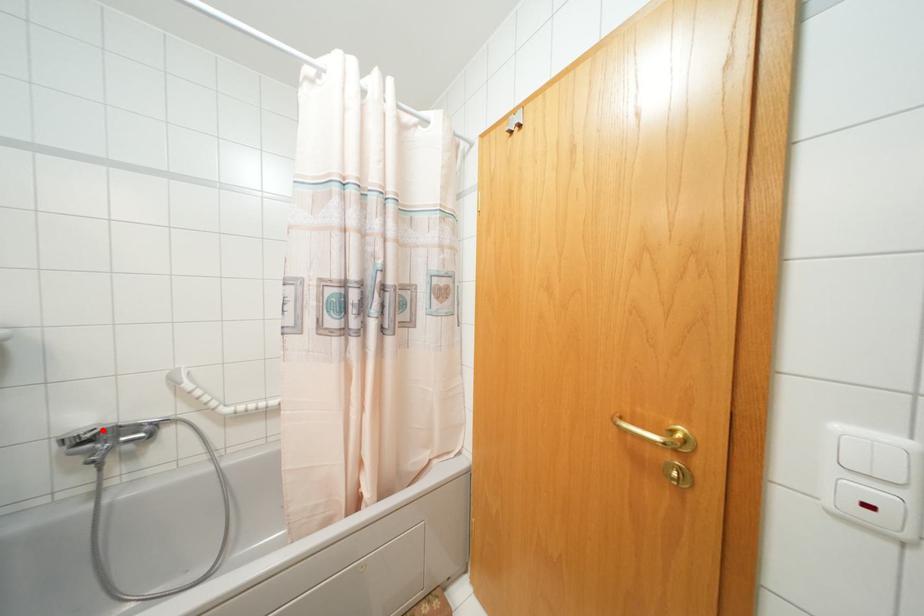
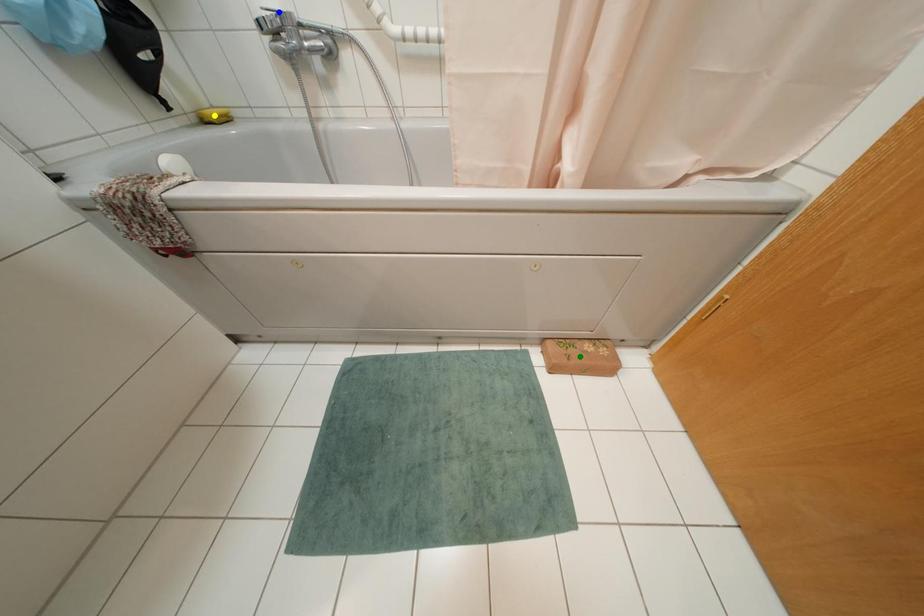
Question: I am providing you with two images of the same scene from different viewpoints. A red point is marked on the first image. You are given multiple points on the second image. In image 2, which mark is for the same physical point as the one in image 1?

Choices:
 (A) blue point
 (B) yellow point
 (C) green point

Answer: (A)